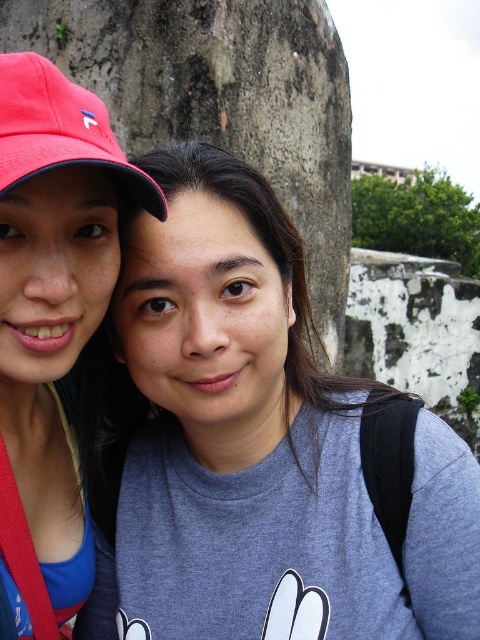
You are a photographer trying to frame a shot of the matte pink cap at left and the matte red baseball cap at upper left. Which cap should you adjust to ensure both are fully visible in the frame?

The matte pink cap at left is taller than the matte red baseball cap at upper left. To ensure both are fully visible in the frame, you should lower the angle slightly to accommodate the height of the matte pink cap at left.

You are taking a photo of two people standing near a stone wall. You notice the matte pink cap at left and the matte red baseball cap at upper left. Which of these two caps is positioned more to the left side of the photo?

The matte pink cap at left is positioned more to the left side of the photo than the matte red baseball cap at upper left.